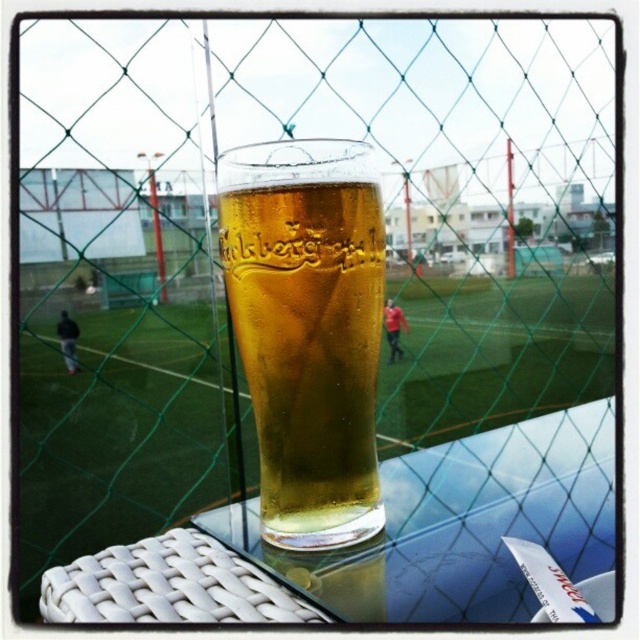
Is transparent glass table at center taller than translucent glass beer at center?

No, transparent glass table at center is not taller than translucent glass beer at center.

Between transparent glass table at center and translucent glass beer at center, which one is positioned higher?

translucent glass beer at center is higher up.

Is point (493, 573) more distant than point (240, 266)?

No.

You are a GUI agent. You are given a task and a screenshot of the screen. Output one action in this format:
    pyautogui.click(x=<x>, y=<y>)
    Task: Click on the transparent glass table at center
    This screenshot has height=640, width=640.
    Given the screenshot: What is the action you would take?
    pyautogui.click(x=381, y=540)